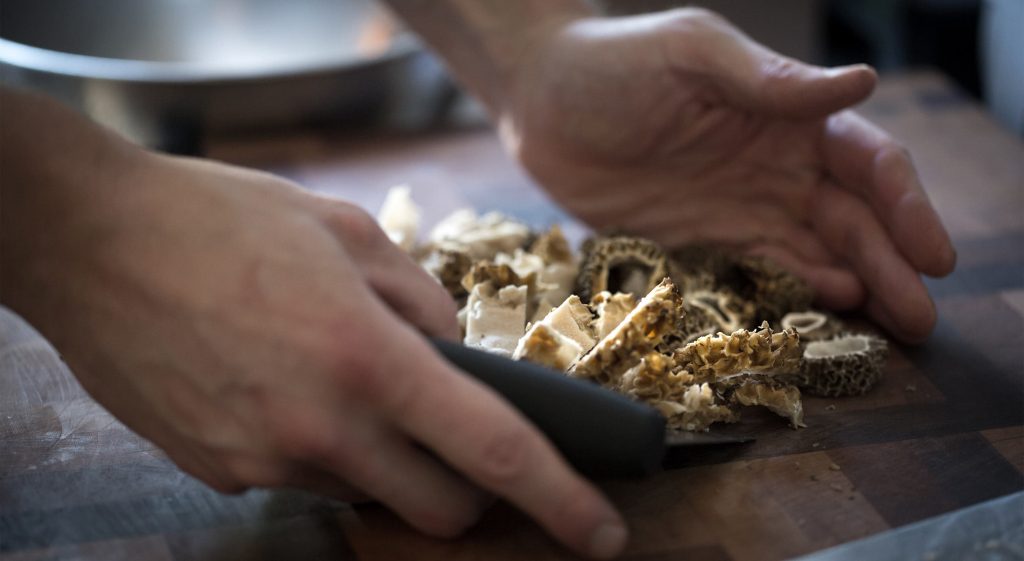
Locate an element on the screen. wooden preparation table is located at coordinates (927, 466), (959, 171), (120, 484).